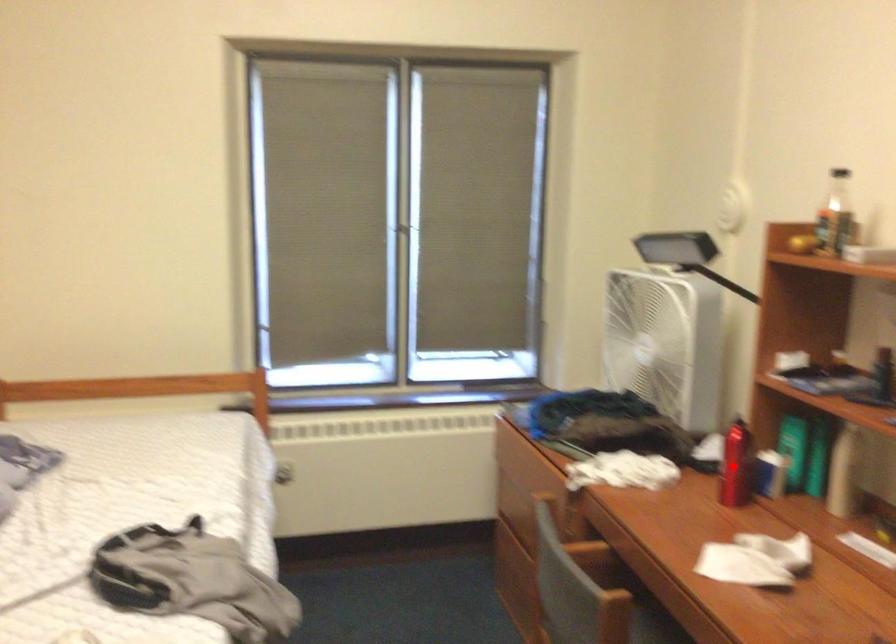
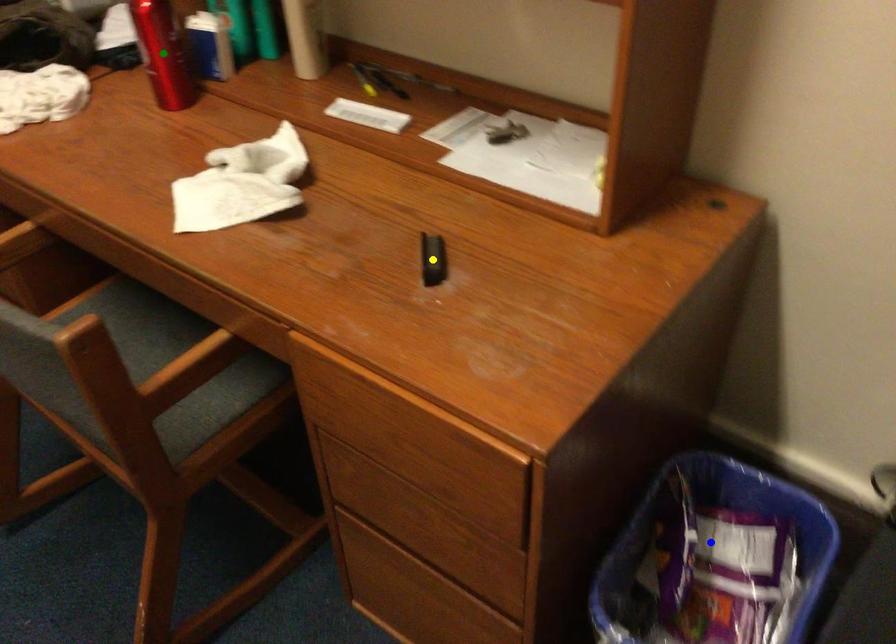
Question: I am providing you with two images of the same scene from different viewpoints. A red point is marked on the first image. You are given multiple points on the second image. Can you choose the point in image 2 that corresponds to the point in image 1?

Choices:
 (A) blue point
 (B) green point
 (C) yellow point

Answer: (B)